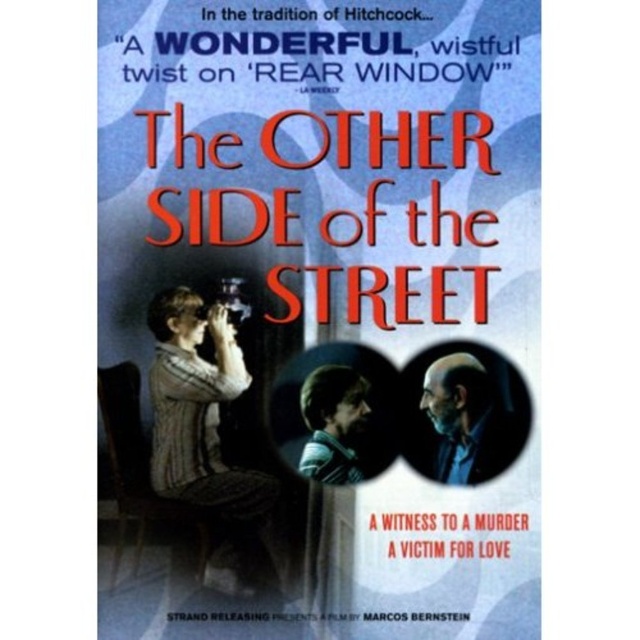
You are a costume designer analyzing the movie poster for The Other Side of the Street. You notice the knitted sweater at center and the smooth brown hair at center. Which object is positioned higher up on the poster?

The knitted sweater at center is much taller as smooth brown hair at center, so the knitted sweater at center is positioned higher up on the poster.